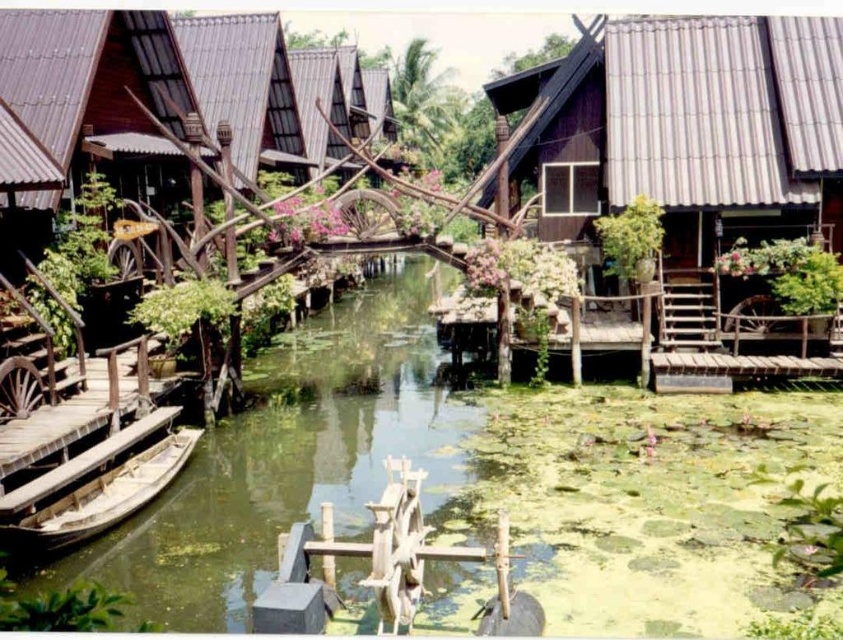
Question: Does wooden hut at center appear on the left side of wooden boat at lower left?

Choices:
 (A) yes
 (B) no

Answer: (B)

Question: Does wooden hut at center have a greater width compared to wooden boat at lower left?

Choices:
 (A) no
 (B) yes

Answer: (B)

Question: Which point appears closest to the camera in this image?

Choices:
 (A) (321, 161)
 (B) (405, 339)
 (C) (675, 198)

Answer: (C)

Question: Which point is farther to the camera?

Choices:
 (A) wooden hut at center
 (B) dark brown wood hut at upper right

Answer: (A)

Question: Which of the following is the farthest from the observer?

Choices:
 (A) dark brown wood hut at upper right
 (B) wooden boat at lower left
 (C) green algae-covered water at center

Answer: (A)

Question: Is green algae-covered water at center to the left of wooden hut at center from the viewer's perspective?

Choices:
 (A) yes
 (B) no

Answer: (B)